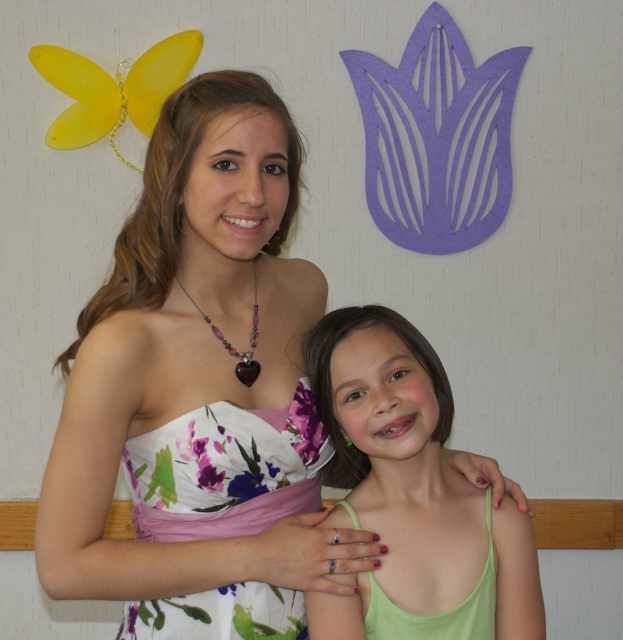
Where is the white floral dress at center located in the image?

The white floral dress at center is located at point (201, 392).